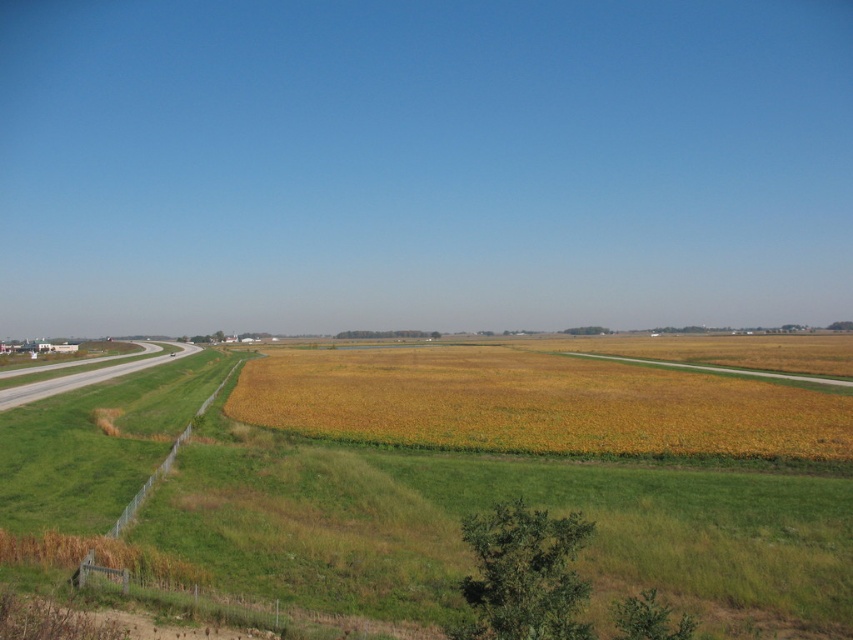
Which is more to the right, yellow-green grassland at center or yellow-green grain at center?

From the viewer's perspective, yellow-green grain at center appears more on the right side.

You are a GUI agent. You are given a task and a screenshot of the screen. Output one action in this format:
    pyautogui.click(x=<x>, y=<y>)
    Task: Click on the yellow-green grassland at center
    This screenshot has height=640, width=853.
    Given the screenshot: What is the action you would take?
    pyautogui.click(x=509, y=484)

Between point (665, 476) and point (514, 380), which one is positioned behind?

Positioned behind is point (514, 380).

What are the coordinates of `yellow-green grassland at center` in the screenshot? It's located at (509, 484).

Which is more to the left, yellow-green grain at center or gray asphalt runway at left?

From the viewer's perspective, gray asphalt runway at left appears more on the left side.

Is yellow-green grain at center above gray asphalt runway at left?

Correct, yellow-green grain at center is located above gray asphalt runway at left.

The height and width of the screenshot is (640, 853). What do you see at coordinates (535, 403) in the screenshot? I see `yellow-green grain at center` at bounding box center [535, 403].

I want to click on yellow-green grain at center, so click(535, 403).

In the scene shown: Who is taller, yellow-green grassland at center or gray asphalt runway at left?

Standing taller between the two is gray asphalt runway at left.

Can you confirm if yellow-green grassland at center is shorter than gray asphalt runway at left?

Yes.

This screenshot has width=853, height=640. Identify the location of yellow-green grassland at center. (509, 484).